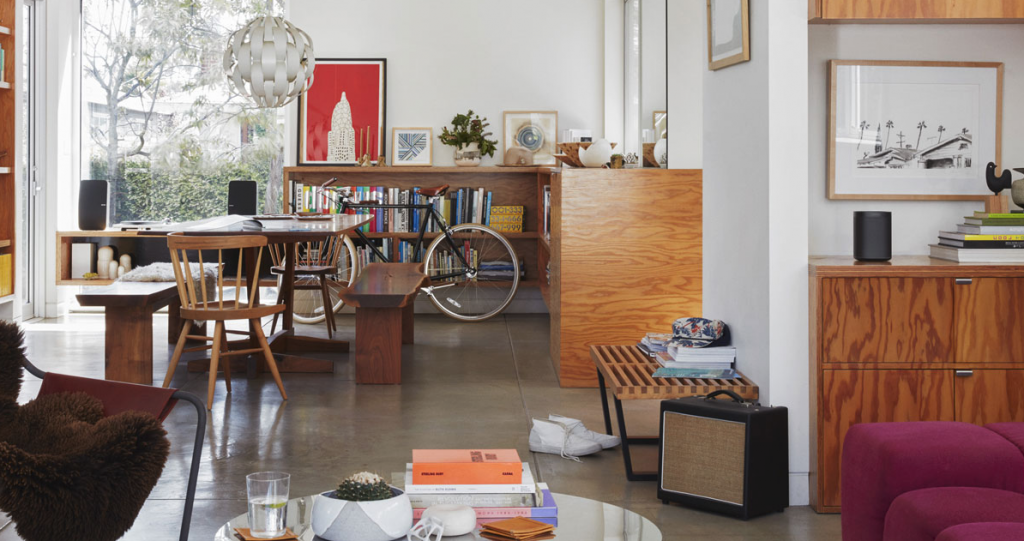
The image size is (1024, 541). Find the location of `picture`. picture is located at coordinates (873, 237), (906, 163).